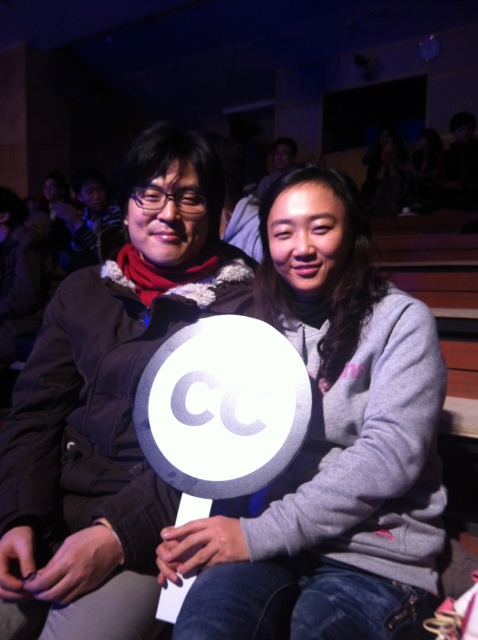
Question: Considering the real-world distances, which object is closest to the white plastic sign at center?

Choices:
 (A) dark gray fleece jacket at center
 (B) gray fleece sweatshirt at center

Answer: (B)

Question: Is the position of gray fleece sweatshirt at center less distant than that of white plastic sign at center?

Choices:
 (A) no
 (B) yes

Answer: (B)

Question: Among these objects, which one is nearest to the camera?

Choices:
 (A) gray fleece sweatshirt at center
 (B) dark gray fleece jacket at center

Answer: (A)

Question: Which point is farther to the camera?

Choices:
 (A) dark gray fleece jacket at center
 (B) gray fleece sweatshirt at center
 (C) white plastic sign at center

Answer: (C)

Question: Can you confirm if gray fleece sweatshirt at center is wider than white plastic sign at center?

Choices:
 (A) yes
 (B) no

Answer: (A)

Question: From the image, what is the correct spatial relationship of gray fleece sweatshirt at center in relation to dark gray fleece jacket at center?

Choices:
 (A) below
 (B) above

Answer: (A)